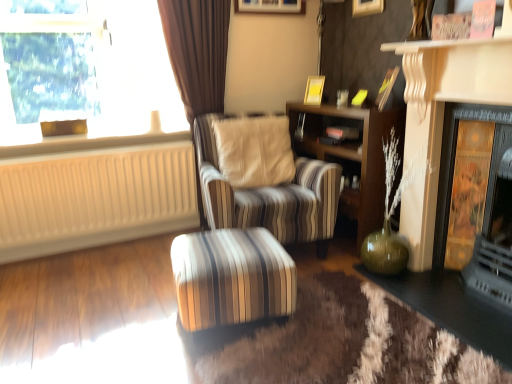
Question: Should I look upward or downward to see green glass vase at lower right, which ranks as the first table in right-to-left order?

Choices:
 (A) up
 (B) down

Answer: (B)

Question: From the image's perspective, is matte gold picture frame at upper center, the first picture frame positioned from the right, above gold textured panel at right?

Choices:
 (A) no
 (B) yes

Answer: (B)

Question: Does matte gold picture frame at upper center, arranged as the first picture frame when viewed from the top, appear on the left side of gold textured panel at right?

Choices:
 (A) yes
 (B) no

Answer: (A)

Question: Is matte gold picture frame at upper center, arranged as the first picture frame when viewed from the top, further to camera compared to gold textured panel at right?

Choices:
 (A) yes
 (B) no

Answer: (A)

Question: Is matte gold picture frame at upper center, the third picture frame positioned from the bottom, bigger than gold textured panel at right?

Choices:
 (A) yes
 (B) no

Answer: (B)

Question: Is matte gold picture frame at upper center, the third picture frame positioned from the bottom, looking in the opposite direction of gold textured panel at right?

Choices:
 (A) yes
 (B) no

Answer: (B)

Question: Would you say matte gold picture frame at upper center, the first picture frame positioned from the right, is outside gold textured panel at right?

Choices:
 (A) no
 (B) yes

Answer: (B)

Question: Considering the relative positions of wooden bookshelf at center and striped fabric chair at center in the image provided, is wooden bookshelf at center in front of striped fabric chair at center?

Choices:
 (A) yes
 (B) no

Answer: (B)

Question: Is striped fabric chair at center a part of wooden bookshelf at center?

Choices:
 (A) no
 (B) yes

Answer: (A)

Question: Considering the relative sizes of wooden bookshelf at center and striped fabric chair at center in the image provided, is wooden bookshelf at center bigger than striped fabric chair at center?

Choices:
 (A) yes
 (B) no

Answer: (B)

Question: Is wooden bookshelf at center far away from striped fabric chair at center?

Choices:
 (A) yes
 (B) no

Answer: (B)

Question: Is wooden bookshelf at center beside striped fabric chair at center?

Choices:
 (A) no
 (B) yes

Answer: (A)

Question: From a real-world perspective, does wooden bookshelf at center stand above striped fabric chair at center?

Choices:
 (A) no
 (B) yes

Answer: (A)

Question: Can you confirm if beige ribbed radiator at left is taller than gold textured panel at right?

Choices:
 (A) yes
 (B) no

Answer: (B)